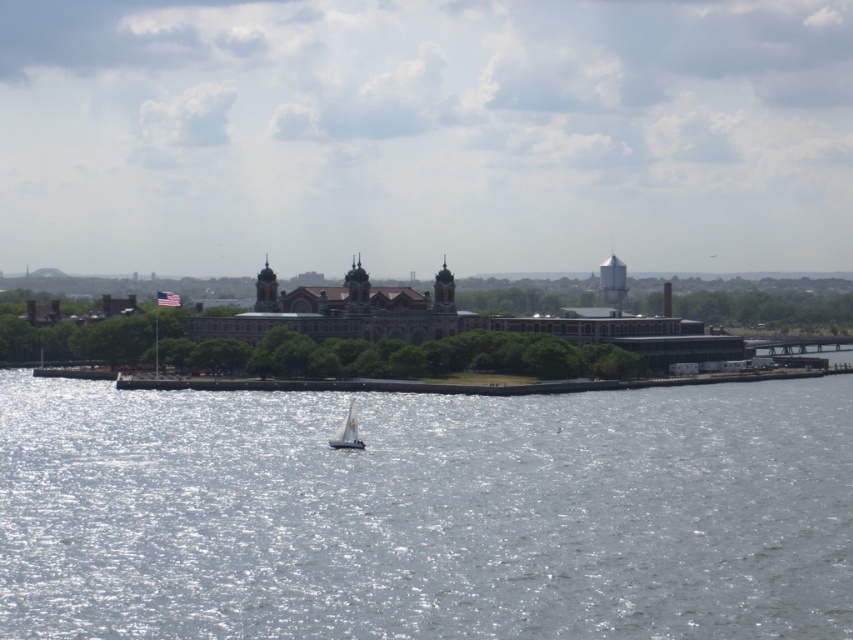
Does reflective silver water at center have a greater height compared to white sailboat at center?

Yes.

Is reflective silver water at center smaller than white sailboat at center?

Actually, reflective silver water at center might be larger than white sailboat at center.

Identify the location of reflective silver water at center. This screenshot has height=640, width=853. (426, 513).